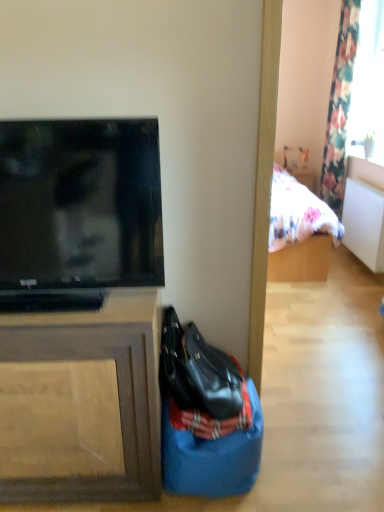
Question: Is brown wood cabinet at left facing away from blue fabric sack at lower center?

Choices:
 (A) yes
 (B) no

Answer: (B)

Question: Can you confirm if brown wood cabinet at left is positioned to the left of blue fabric sack at lower center?

Choices:
 (A) yes
 (B) no

Answer: (A)

Question: Would you say brown wood cabinet at left contains blue fabric sack at lower center?

Choices:
 (A) yes
 (B) no

Answer: (B)

Question: From the image's perspective, is brown wood cabinet at left located above blue fabric sack at lower center?

Choices:
 (A) no
 (B) yes

Answer: (B)

Question: Is brown wood cabinet at left at the right side of blue fabric sack at lower center?

Choices:
 (A) yes
 (B) no

Answer: (B)

Question: From a real-world perspective, is shiny black handbag at lower center above or below floral fabric curtain at upper right?

Choices:
 (A) above
 (B) below

Answer: (B)

Question: Is shiny black handbag at lower center wider or thinner than floral fabric curtain at upper right?

Choices:
 (A) wide
 (B) thin

Answer: (A)

Question: From the image's perspective, is shiny black handbag at lower center positioned above or below floral fabric curtain at upper right?

Choices:
 (A) below
 (B) above

Answer: (A)

Question: Is shiny black handbag at lower center inside or outside of floral fabric curtain at upper right?

Choices:
 (A) outside
 (B) inside

Answer: (A)

Question: Based on their positions, is brown wood cabinet at left located to the left or right of blue fabric sack at lower center?

Choices:
 (A) left
 (B) right

Answer: (A)

Question: From the image's perspective, is brown wood cabinet at left located above or below blue fabric sack at lower center?

Choices:
 (A) above
 (B) below

Answer: (A)

Question: Do you think brown wood cabinet at left is within blue fabric sack at lower center, or outside of it?

Choices:
 (A) outside
 (B) inside

Answer: (A)

Question: Does point (99, 392) appear closer or farther from the camera than point (165, 423)?

Choices:
 (A) farther
 (B) closer

Answer: (B)

Question: From their relative heights in the image, would you say floral fabric curtain at upper right is taller or shorter than blue fabric sack at lower center?

Choices:
 (A) tall
 (B) short

Answer: (A)

Question: Which is correct: floral fabric curtain at upper right is inside blue fabric sack at lower center, or outside of it?

Choices:
 (A) inside
 (B) outside

Answer: (B)